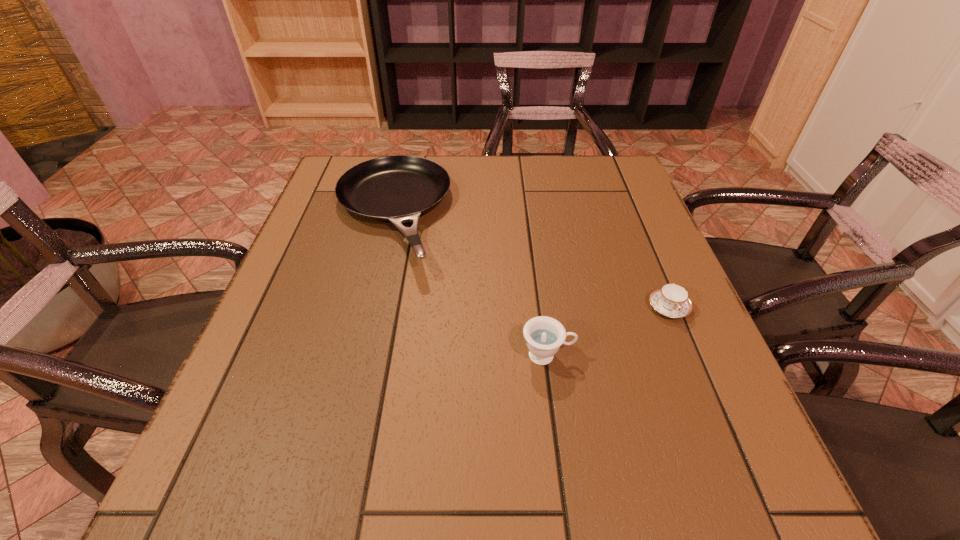
At what (x,y) coordinates should I click in order to perform the action: click on free space between the nearer teacup and the rightmost object. Please return your answer as a coordinate pair (x, y). Looking at the image, I should click on (608, 331).

Locate an element on the screen. The image size is (960, 540). vacant area between the nearer teacup and the leftmost object is located at coordinates (468, 285).

The height and width of the screenshot is (540, 960). I want to click on free space between the leftmost object and the left teacup, so coord(468,285).

You are a GUI agent. You are given a task and a screenshot of the screen. Output one action in this format:
    pyautogui.click(x=<x>, y=<y>)
    Task: Click on the vacant point located between the right teacup and the farthest object
    The image size is (960, 540).
    Given the screenshot: What is the action you would take?
    pyautogui.click(x=530, y=261)

I want to click on empty location between the nearest object and the leftmost object, so click(468, 285).

Locate an element on the screen. free space between the shortest object and the taller teacup is located at coordinates (608, 331).

Image resolution: width=960 pixels, height=540 pixels. Identify the location of empty space between the left teacup and the leftmost object. (468, 285).

Find the location of a particular element. The height and width of the screenshot is (540, 960). empty space that is in between the taller teacup and the rightmost object is located at coordinates (608, 331).

Identify the location of empty space that is in between the nearer teacup and the farther teacup. (608, 331).

Choose which object is the second nearest neighbor to the pan. Please provide its 2D coordinates. Your answer should be formatted as a tuple, i.e. [(x, y)], where the tuple contains the x and y coordinates of a point satisfying the conditions above.

[(671, 300)]